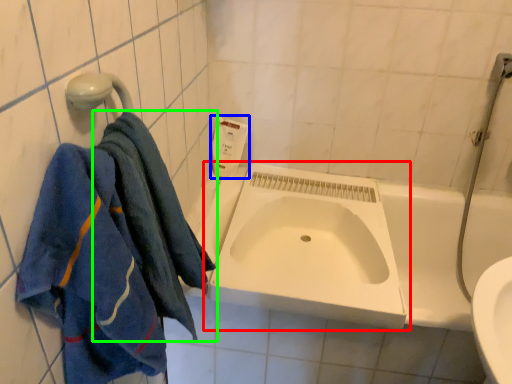
Question: Which object is positioned closest to sink (highlighted by a red box)? Select from soap dispenser (highlighted by a blue box) and towel (highlighted by a green box).

Choices:
 (A) soap dispenser
 (B) towel

Answer: (B)